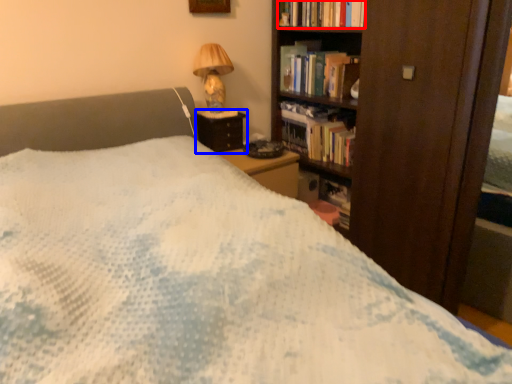
Question: Which object appears closest to the camera in this image, book (highlighted by a red box) or nightstand (highlighted by a blue box)?

Choices:
 (A) book
 (B) nightstand

Answer: (A)